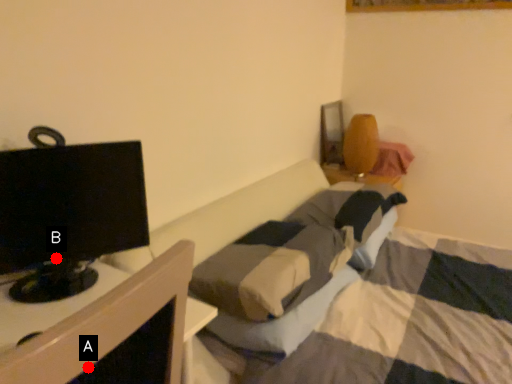
Question: Two points are circled on the image, labeled by A and B beside each circle. Among these points, which one is farthest from the camera?

Choices:
 (A) A is further
 (B) B is further

Answer: (B)